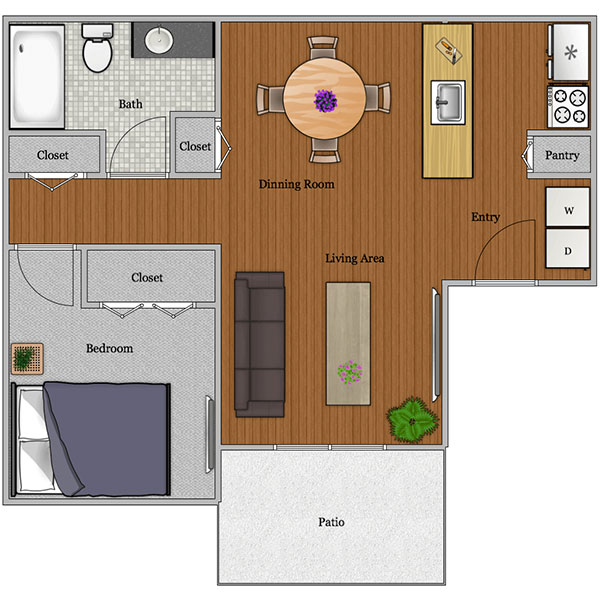
Locate an element on the screen. regular doors is located at coordinates (48, 246), (138, 175), (498, 282).